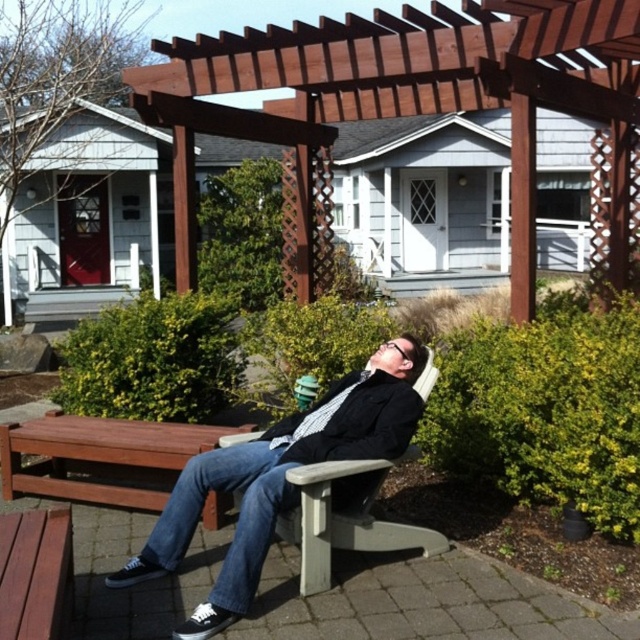
Is brown wood pergola at upper center above wooden park bench at lower left?

Correct, brown wood pergola at upper center is located above wooden park bench at lower left.

What do you see at coordinates (419, 104) in the screenshot? I see `brown wood pergola at upper center` at bounding box center [419, 104].

Is point (532, 42) in front of point (61, 605)?

No.

You are a GUI agent. You are given a task and a screenshot of the screen. Output one action in this format:
    pyautogui.click(x=<x>, y=<y>)
    Task: Click on the brown wood pergola at upper center
    The width and height of the screenshot is (640, 640).
    Given the screenshot: What is the action you would take?
    pyautogui.click(x=419, y=104)

At what (x,y) coordinates should I click in order to perform the action: click on matte black jacket at center. Please return your answer as a coordinate pair (x, y). Looking at the image, I should click on (280, 477).

The image size is (640, 640). Describe the element at coordinates (280, 477) in the screenshot. I see `matte black jacket at center` at that location.

Find the location of a particular element. matte black jacket at center is located at coordinates (280, 477).

Locate an element on the screen. This screenshot has height=640, width=640. brown wood pergola at upper center is located at coordinates (419, 104).

Can you confirm if brown wood pergola at upper center is smaller than matte black jacket at center?

Yes, brown wood pergola at upper center is smaller than matte black jacket at center.

I want to click on brown wood pergola at upper center, so click(x=419, y=104).